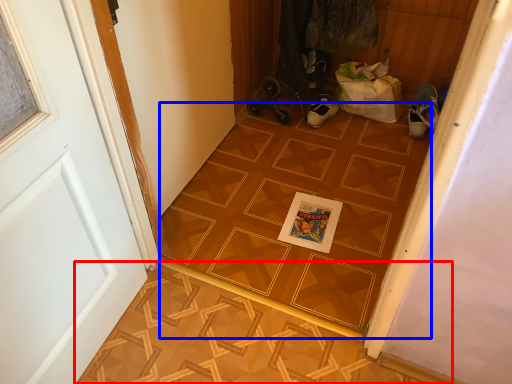
Question: Among these objects, which one is nearest to the camera, tile (highlighted by a red box) or ceramic tile (highlighted by a blue box)?

Choices:
 (A) tile
 (B) ceramic tile

Answer: (A)